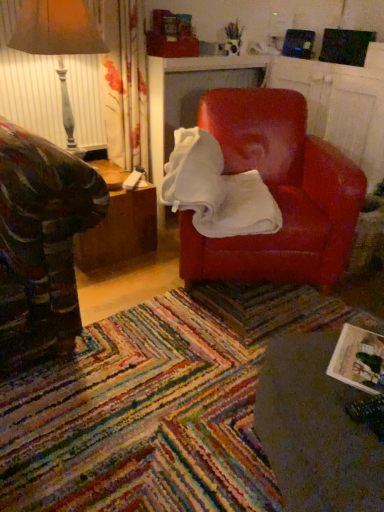
Measure the distance between matte white magazine at lower right and camera.

matte white magazine at lower right and camera are 1.01 meters apart.

Measure the distance between point (222,228) and camera.

The depth of point (222,228) is 5.77 feet.

This screenshot has height=512, width=384. What do you see at coordinates (119, 224) in the screenshot?
I see `woodenmaterial/texturetable at left, placed as the 2th table when sorted from right to left` at bounding box center [119, 224].

Describe the element at coordinates (277, 192) in the screenshot. I see `matte red armchair at center` at that location.

Find the location of a particular element. The image size is (384, 512). matte gray table lamp at left is located at coordinates (58, 41).

You are a GUI agent. You are given a task and a screenshot of the screen. Output one action in this format:
    pyautogui.click(x=<x>, y=<y>)
    Task: Click on the magazine behind the wooden table at lower right, which appears as the 1th table when ordered from the bottom
    This screenshot has height=512, width=384.
    Given the screenshot: What is the action you would take?
    pyautogui.click(x=359, y=360)

Does wooden table at lower right, the 2th table when ordered from back to front, appear on the left side of matte white magazine at lower right?

Indeed, wooden table at lower right, the 2th table when ordered from back to front, is positioned on the left side of matte white magazine at lower right.

Relative to matte white magazine at lower right, is wooden table at lower right, which ranks as the second table in left-to-right order, in front or behind?

Visually, wooden table at lower right, which ranks as the second table in left-to-right order, is located in front of matte white magazine at lower right.

Considering the relative sizes of woodenmaterial/texturetable at left, the second table positioned from the bottom, and matte white magazine at lower right in the image provided, is woodenmaterial/texturetable at left, the second table positioned from the bottom, wider than matte white magazine at lower right?

Yes, woodenmaterial/texturetable at left, the second table positioned from the bottom, is wider than matte white magazine at lower right.

Which object is closer to the camera taking this photo, woodenmaterial/texturetable at left, placed as the 2th table when sorted from right to left, or matte white magazine at lower right?

matte white magazine at lower right is closer to the camera.

Is woodenmaterial/texturetable at left, the first table when ordered from back to front, next to matte white magazine at lower right and touching it?

No, woodenmaterial/texturetable at left, the first table when ordered from back to front, is not making contact with matte white magazine at lower right.

From the image's perspective, which one is positioned higher, woodenmaterial/texturetable at left, placed as the 2th table when sorted from right to left, or matte white magazine at lower right?

woodenmaterial/texturetable at left, placed as the 2th table when sorted from right to left, from the image's perspective.

From a real-world perspective, who is located lower, wooden table at lower right, which appears as the 1th table when ordered from the bottom, or woodenmaterial/texturetable at left, the second table positioned from the bottom?

woodenmaterial/texturetable at left, the second table positioned from the bottom.

Considering the positions of objects wooden table at lower right, the 2th table when ordered from back to front, and woodenmaterial/texturetable at left, arranged as the second table when viewed from the front, in the image provided, who is more to the right, wooden table at lower right, the 2th table when ordered from back to front, or woodenmaterial/texturetable at left, arranged as the second table when viewed from the front,?

From the viewer's perspective, wooden table at lower right, the 2th table when ordered from back to front, appears more on the right side.

Is wooden table at lower right, which is counted as the second table, starting from the top, next to woodenmaterial/texturetable at left, the first table viewed from the left, and touching it?

wooden table at lower right, which is counted as the second table, starting from the top, and woodenmaterial/texturetable at left, the first table viewed from the left, are clearly separated.

How much distance is there between wooden table at lower right, which is the first table from front to back, and woodenmaterial/texturetable at left, which is the 1th table from top to bottom?

The distance of wooden table at lower right, which is the first table from front to back, from woodenmaterial/texturetable at left, which is the 1th table from top to bottom, is 1.38 meters.

From the image's perspective, which object appears higher, wooden table at lower right, which ranks as the second table in left-to-right order, or matte red armchair at center?

matte red armchair at center appears higher in the image.

Considering the sizes of objects wooden table at lower right, the first table in the right-to-left sequence, and matte red armchair at center in the image provided, who is bigger, wooden table at lower right, the first table in the right-to-left sequence, or matte red armchair at center?

matte red armchair at center.

Relative to matte red armchair at center, is wooden table at lower right, which ranks as the second table in left-to-right order, in front or behind?

Clearly, wooden table at lower right, which ranks as the second table in left-to-right order, is in front of matte red armchair at center.

Looking at their sizes, would you say wooden table at lower right, which ranks as the second table in left-to-right order, is wider or thinner than matte red armchair at center?

In the image, wooden table at lower right, which ranks as the second table in left-to-right order, appears to be more narrow than matte red armchair at center.

Considering the positions of points (134, 248) and (320, 334), is point (134, 248) farther from camera compared to point (320, 334)?

Yes.

Considering the sizes of objects woodenmaterial/texturetable at left, the first table viewed from the left, and wooden table at lower right, which ranks as the second table in left-to-right order, in the image provided, who is taller, woodenmaterial/texturetable at left, the first table viewed from the left, or wooden table at lower right, which ranks as the second table in left-to-right order,?

woodenmaterial/texturetable at left, the first table viewed from the left, is taller.

From the image's perspective, who appears lower, woodenmaterial/texturetable at left, the second table positioned from the bottom, or wooden table at lower right, the 2th table when ordered from back to front?

wooden table at lower right, the 2th table when ordered from back to front, from the image's perspective.

Considering the sizes of matte leather chair at center and matte gray table lamp at left in the image, is matte leather chair at center bigger or smaller than matte gray table lamp at left?

Clearly, matte leather chair at center is larger in size than matte gray table lamp at left.

At what (x,y) coordinates should I click in order to perform the action: click on table lamp above the matte leather chair at center (from a real-world perspective). Please return your answer as a coordinate pair (x, y). Looking at the image, I should click on (58, 41).

From a real-world perspective, is matte leather chair at center physically below matte gray table lamp at left?

Yes, from a real-world perspective, matte leather chair at center is below matte gray table lamp at left.

Does matte leather chair at center appear on the right side of matte gray table lamp at left?

Yes, matte leather chair at center is to the right of matte gray table lamp at left.

Does wooden table at lower right, which is the first table from front to back, lie in front of matte leather chair at center?

That is True.

Between wooden table at lower right, which ranks as the second table in left-to-right order, and matte leather chair at center, which one appears on the left side from the viewer's perspective?

matte leather chair at center is more to the left.

From a real-world perspective, which is physically below, wooden table at lower right, the first table in the right-to-left sequence, or matte leather chair at center?

wooden table at lower right, the first table in the right-to-left sequence, is physically lower.

Based on the photo, which of these two, wooden table at lower right, which ranks as the second table in left-to-right order, or matte leather chair at center, is smaller?

wooden table at lower right, which ranks as the second table in left-to-right order, is smaller.

From a real-world perspective, starting from the matte white magazine at lower right, which table is the 1st one below it? Please provide its 2D coordinates.

[(315, 430)]

I want to click on magazine above the woodenmaterial/texturetable at left, arranged as the second table when viewed from the front (from a real-world perspective), so click(359, 360).

From the image, which object appears to be nearer to matte red armchair at center, matte leather chair at center or wooden table at lower right, which is counted as the second table, starting from the top?

The object closer to matte red armchair at center is matte leather chair at center.

Which object lies nearer to the anchor point matte white magazine at lower right, matte gray table lamp at left or matte red armchair at center?

matte red armchair at center is closer to matte white magazine at lower right.

Consider the image. Considering their positions, is matte leather chair at center positioned further to matte white magazine at lower right than woodenmaterial/texturetable at left, which is the 1th table from top to bottom?

Based on the image, woodenmaterial/texturetable at left, which is the 1th table from top to bottom, appears to be further to matte white magazine at lower right.

Looking at this image, based on their spatial positions, is matte leather chair at center or woodenmaterial/texturetable at left, the second table positioned from the bottom, further from wooden table at lower right, which ranks as the second table in left-to-right order?

woodenmaterial/texturetable at left, the second table positioned from the bottom, lies further to wooden table at lower right, which ranks as the second table in left-to-right order, than the other object.

Based on their spatial positions, is matte red armchair at center or matte white magazine at lower right further from woodenmaterial/texturetable at left, the first table when ordered from back to front?

matte white magazine at lower right lies further to woodenmaterial/texturetable at left, the first table when ordered from back to front, than the other object.

Looking at the image, which one is located further to wooden table at lower right, the first table in the right-to-left sequence, matte red armchair at center or woodenmaterial/texturetable at left, which is the 1th table from top to bottom?

woodenmaterial/texturetable at left, which is the 1th table from top to bottom, lies further to wooden table at lower right, the first table in the right-to-left sequence, than the other object.

From the image, which object appears to be farther from woodenmaterial/texturetable at left, the first table viewed from the left, matte leather chair at center or matte white magazine at lower right?

The object further to woodenmaterial/texturetable at left, the first table viewed from the left, is matte white magazine at lower right.

Which object lies nearer to the anchor point matte white magazine at lower right, matte red armchair at center or matte leather chair at center?

matte leather chair at center is closer to matte white magazine at lower right.

Locate an element on the screen. chair that lies between matte gray table lamp at left and wooden table at lower right, which is counted as the second table, starting from the top, from top to bottom is located at coordinates (277, 192).

The image size is (384, 512). Identify the location of material situated between matte gray table lamp at left and matte red armchair at center from left to right. (216, 190).

This screenshot has height=512, width=384. Find the location of `magazine positioned between wooden table at lower right, the first table in the right-to-left sequence, and woodenmaterial/texturetable at left, which is the 1th table from top to bottom, from near to far`. magazine positioned between wooden table at lower right, the first table in the right-to-left sequence, and woodenmaterial/texturetable at left, which is the 1th table from top to bottom, from near to far is located at coordinates (359, 360).

Find the location of a particular element. The height and width of the screenshot is (512, 384). chair between matte leather chair at center and matte white magazine at lower right from top to bottom is located at coordinates (277, 192).